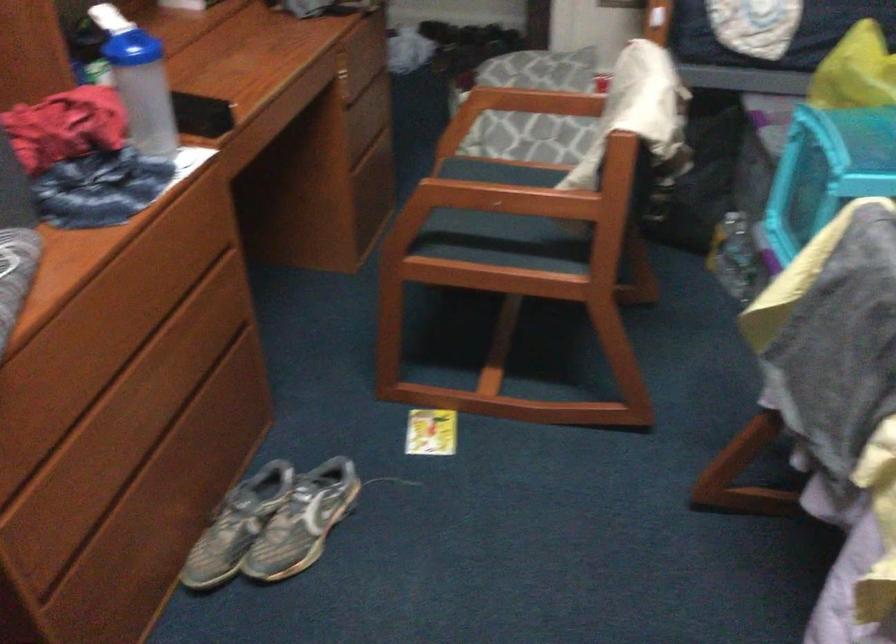
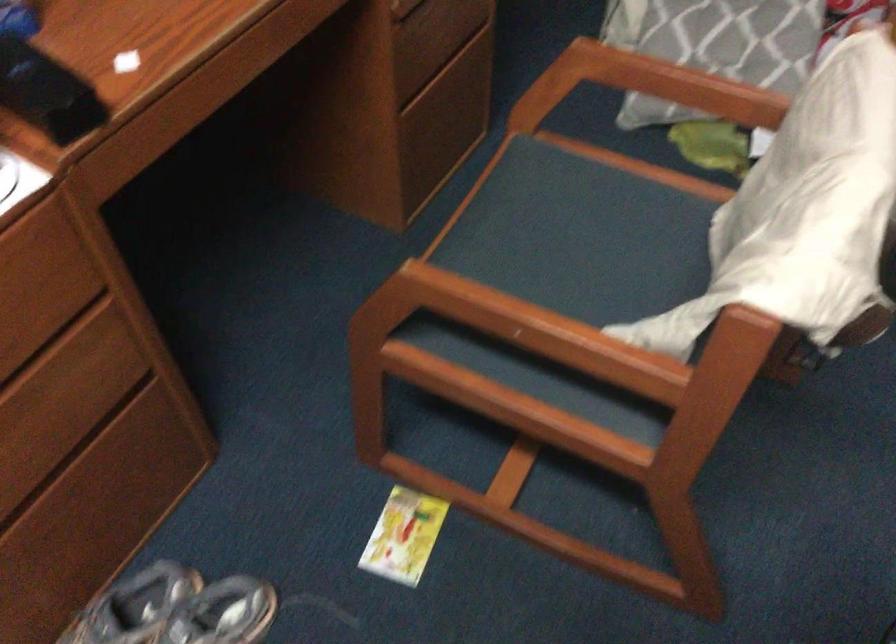
Question: Based on the continuous images, in which direction is the camera rotating? Reply with the corresponding letter.

Choices:
 (A) Left
 (B) Right
 (C) Up
 (D) Down

Answer: (D)